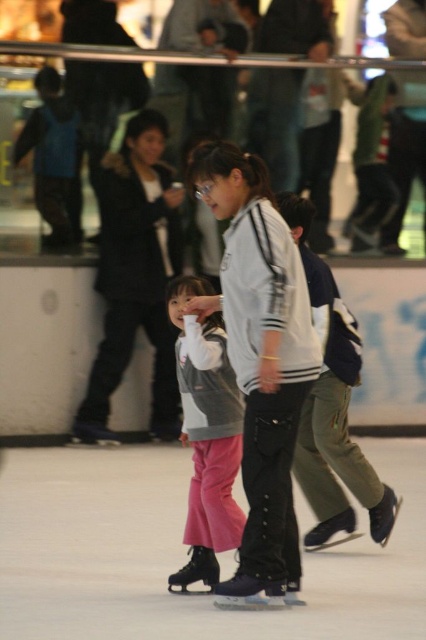
Question: Observing the image, what is the correct spatial positioning of pink fabric pants at center in reference to matte black jacket at center?

Choices:
 (A) above
 (B) below

Answer: (B)

Question: Can you confirm if pink fabric pants at center is smaller than matte gray vest at center?

Choices:
 (A) yes
 (B) no

Answer: (A)

Question: Which object appears farthest from the camera in this image?

Choices:
 (A) white matte jacket at center
 (B) matte black jacket at center

Answer: (B)

Question: Is white matte jacket at center further to camera compared to matte black jacket at center?

Choices:
 (A) yes
 (B) no

Answer: (B)

Question: Which is farther from the pink fabric pants at center?

Choices:
 (A) matte gray vest at center
 (B) matte black jacket at center
 (C) white matte jacket at center

Answer: (C)

Question: Which point is farther to the camera?

Choices:
 (A) white matte jacket at center
 (B) matte black jacket at center
 (C) pink fabric pants at center
 (D) matte gray vest at center

Answer: (B)